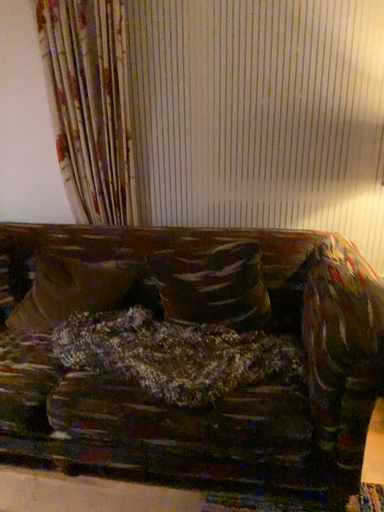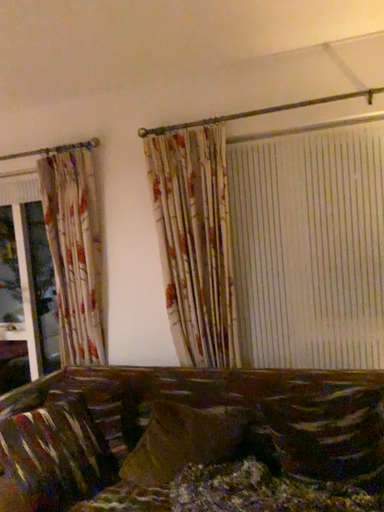
Question: Which way did the camera rotate in the video?

Choices:
 (A) rotated left
 (B) rotated right

Answer: (A)